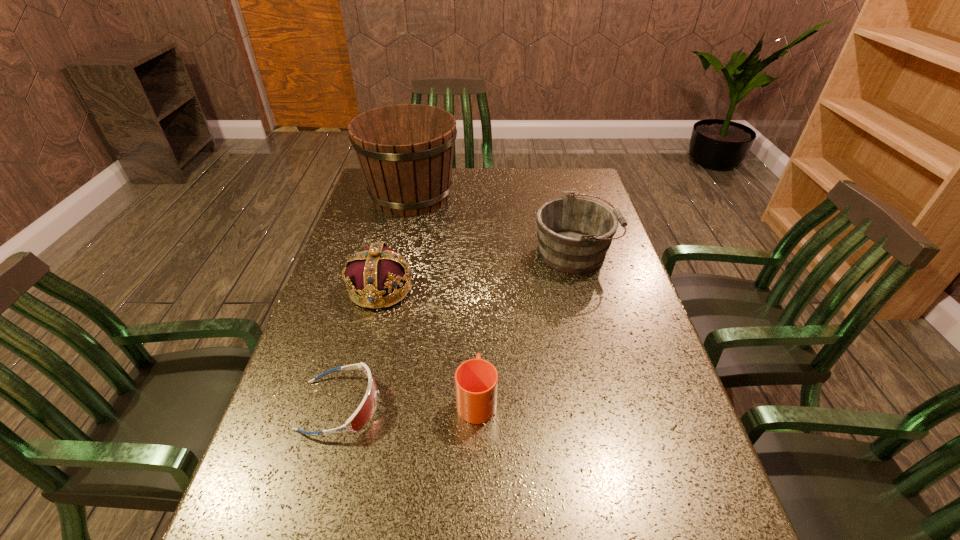
Find the location of a particular element. the left wine bucket is located at coordinates (405, 152).

Find the location of a particular element. The height and width of the screenshot is (540, 960). the tallest object is located at coordinates (405, 152).

Find the location of a particular element. The width and height of the screenshot is (960, 540). the shorter wine bucket is located at coordinates (574, 234).

Identify the location of the rightmost object. The width and height of the screenshot is (960, 540). (574, 234).

What are the coordinates of `crown` in the screenshot? It's located at 372,273.

Locate an element on the screen. Image resolution: width=960 pixels, height=540 pixels. the second shortest object is located at coordinates (476, 380).

The width and height of the screenshot is (960, 540). Identify the location of the second object from right to left. (476, 380).

Identify the location of goggles. (365, 411).

Locate an element on the screen. The width and height of the screenshot is (960, 540). blank area located 0.150m on the front of the left wine bucket is located at coordinates (398, 251).

Locate an element on the screen. This screenshot has width=960, height=540. vacant space situated on the left of the rightmost object is located at coordinates pos(466,253).